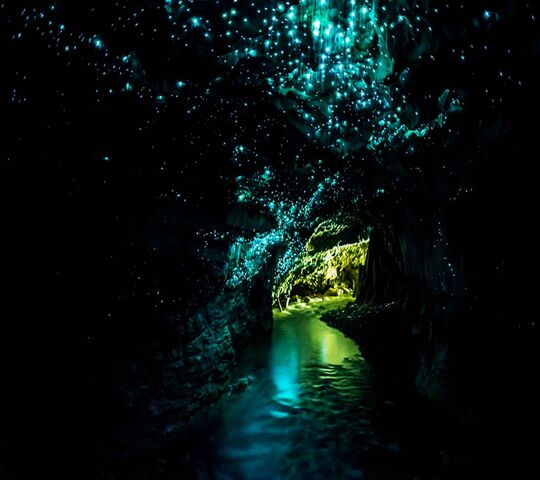
This screenshot has height=480, width=540. What are the coordinates of `black wall` in the screenshot? It's located at (469, 360).